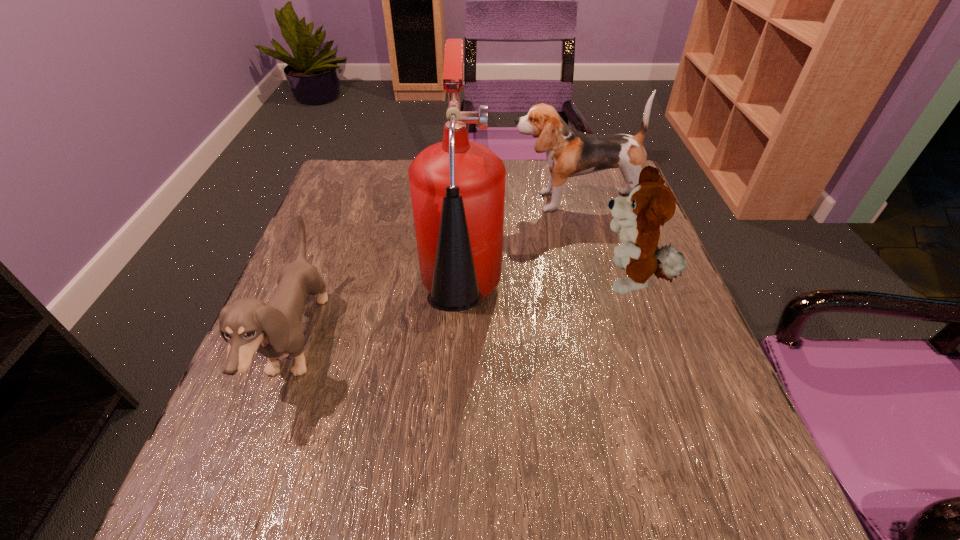
I want to click on the third object from right to left, so point(457,186).

This screenshot has width=960, height=540. What are the coordinates of `fire extinguisher` in the screenshot? It's located at (457, 186).

Locate an element on the screen. the tallest puppy is located at coordinates (570, 153).

At what (x,y) coordinates should I click in order to perform the action: click on the third shortest object. Please return your answer as a coordinate pair (x, y). The image size is (960, 540). Looking at the image, I should click on (570, 153).

Find the location of `the second tallest puppy`. the second tallest puppy is located at coordinates [650, 204].

What are the coordinates of `the shortest object` in the screenshot? It's located at (249, 325).

You are a GUI agent. You are given a task and a screenshot of the screen. Output one action in this format:
    pyautogui.click(x=<x>, y=<y>)
    Task: Click on the shortest puppy
    
    Given the screenshot: What is the action you would take?
    (x=249, y=325)

Locate an element on the screen. vacant space located 0.130m with the nozzle aimed from the tallest object is located at coordinates (454, 449).

Identify the location of free space located 0.160m at the face of the second tallest object. This screenshot has height=540, width=960. (448, 201).

Identify the location of vacant space located 0.300m at the face of the second tallest object. (395, 201).